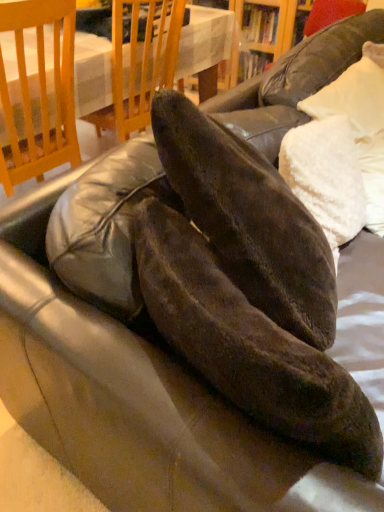
Question: Should I look upward or downward to see white fluffy pillow at upper right?

Choices:
 (A) down
 (B) up

Answer: (B)

Question: Is white fluffy pillow at upper right wider than wooden table at upper center?

Choices:
 (A) yes
 (B) no

Answer: (B)

Question: Is white fluffy pillow at upper right shorter than wooden table at upper center?

Choices:
 (A) yes
 (B) no

Answer: (A)

Question: Does white fluffy pillow at upper right turn towards wooden table at upper center?

Choices:
 (A) yes
 (B) no

Answer: (B)

Question: Is white fluffy pillow at upper right completely or partially outside of wooden table at upper center?

Choices:
 (A) yes
 (B) no

Answer: (A)

Question: Is white fluffy pillow at upper right oriented away from wooden table at upper center?

Choices:
 (A) yes
 (B) no

Answer: (A)

Question: From a real-world perspective, is white fluffy pillow at upper right physically above wooden table at upper center?

Choices:
 (A) yes
 (B) no

Answer: (A)

Question: Is wooden table at upper center turned away from matte black shoe at center?

Choices:
 (A) no
 (B) yes

Answer: (A)

Question: Could matte black shoe at center be considered to be inside wooden table at upper center?

Choices:
 (A) yes
 (B) no

Answer: (B)

Question: From a real-world perspective, is wooden table at upper center under matte black shoe at center?

Choices:
 (A) yes
 (B) no

Answer: (A)

Question: Is wooden table at upper center completely or partially outside of matte black shoe at center?

Choices:
 (A) no
 (B) yes

Answer: (B)

Question: Can you see wooden table at upper center touching matte black shoe at center?

Choices:
 (A) no
 (B) yes

Answer: (A)

Question: From a real-world perspective, is wooden table at upper center located higher than matte black shoe at center?

Choices:
 (A) no
 (B) yes

Answer: (A)

Question: Does wooden table at upper center lie in front of white fluffy pillow at upper right?

Choices:
 (A) no
 (B) yes

Answer: (A)